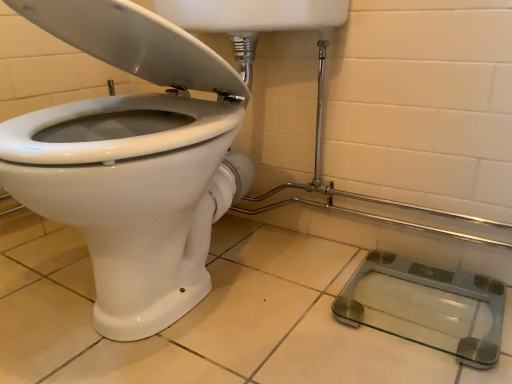
Find the location of `vacant region below transparent glass scale at lower right (from a real-world perspective)`. vacant region below transparent glass scale at lower right (from a real-world perspective) is located at coordinates (421, 307).